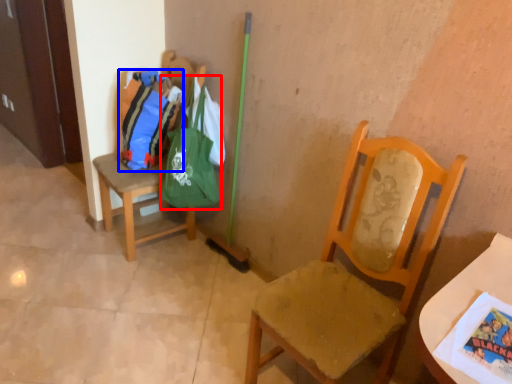
Question: Which point is further to the camera, bag (highlighted by a red box) or bag (highlighted by a blue box)?

Choices:
 (A) bag
 (B) bag

Answer: (B)